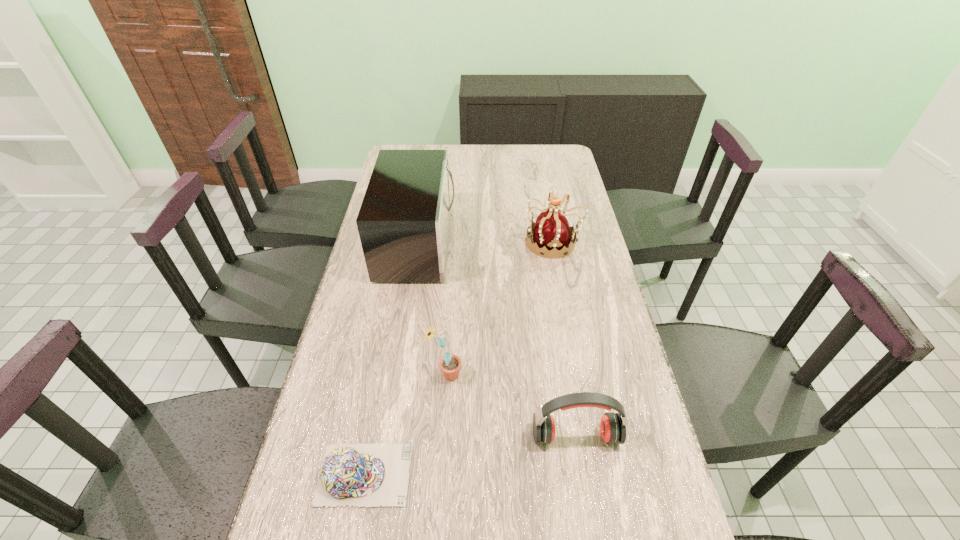
The image size is (960, 540). I want to click on empty space that is in between the earphone and the tiara, so click(564, 339).

Find the location of a particular element. Image resolution: width=960 pixels, height=540 pixels. unoccupied area between the sunflower and the shortest object is located at coordinates (405, 424).

Locate an element on the screen. Image resolution: width=960 pixels, height=540 pixels. vacant space that is in between the tiara and the earphone is located at coordinates (564, 339).

In order to click on empty space that is in between the earphone and the sunflower in this screenshot , I will do `click(511, 406)`.

You are a GUI agent. You are given a task and a screenshot of the screen. Output one action in this format:
    pyautogui.click(x=<x>, y=<y>)
    Task: Click on the vacant area that lies between the cap and the microwave oven
    Image resolution: width=960 pixels, height=540 pixels.
    Given the screenshot: What is the action you would take?
    pyautogui.click(x=391, y=359)

Locate an element on the screen. Image resolution: width=960 pixels, height=540 pixels. empty space between the sunflower and the earphone is located at coordinates (511, 406).

Find the location of a particular element. The height and width of the screenshot is (540, 960). free space that is in between the tiara and the microwave oven is located at coordinates (486, 242).

Locate which object ranks third in proximity to the earphone. Please provide its 2D coordinates. Your answer should be formatted as a tuple, i.e. [(x, y)], where the tuple contains the x and y coordinates of a point satisfying the conditions above.

[(404, 220)]

Point out which object is positioned as the second nearest to the earphone. Please provide its 2D coordinates. Your answer should be formatted as a tuple, i.e. [(x, y)], where the tuple contains the x and y coordinates of a point satisfying the conditions above.

[(370, 475)]

Image resolution: width=960 pixels, height=540 pixels. Identify the location of free space that satisfies the following two spatial constraints: 1. on the ear cups of the earphone; 2. on the front, side, and top of the cap. (582, 474).